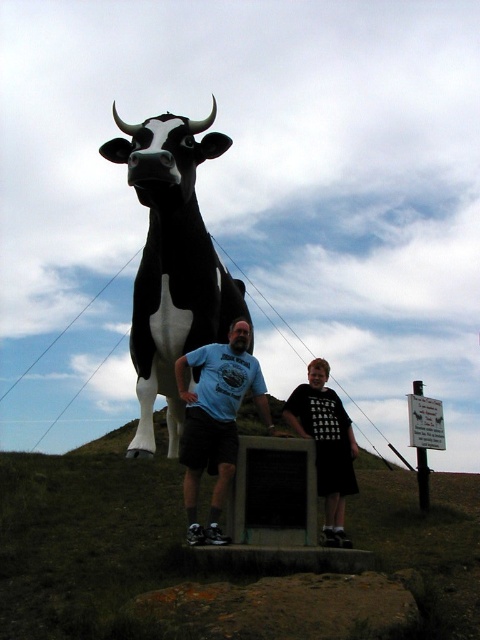
Question: Based on their relative distances, which object is nearer to the black matte cow at center?

Choices:
 (A) matte blue t-shirt at center
 (B) black matte shirt at center

Answer: (A)

Question: Which object is the closest to the black matte cow at center?

Choices:
 (A) matte blue t-shirt at center
 (B) black matte shirt at center

Answer: (A)

Question: Can you confirm if matte blue t-shirt at center is positioned above black matte shirt at center?

Choices:
 (A) no
 (B) yes

Answer: (B)

Question: Is black matte cow at center above matte blue t-shirt at center?

Choices:
 (A) no
 (B) yes

Answer: (B)

Question: Observing the image, what is the correct spatial positioning of black matte cow at center in reference to matte blue t-shirt at center?

Choices:
 (A) above
 (B) below

Answer: (A)

Question: Which is nearer to the black matte shirt at center?

Choices:
 (A) matte blue t-shirt at center
 (B) black matte cow at center

Answer: (A)